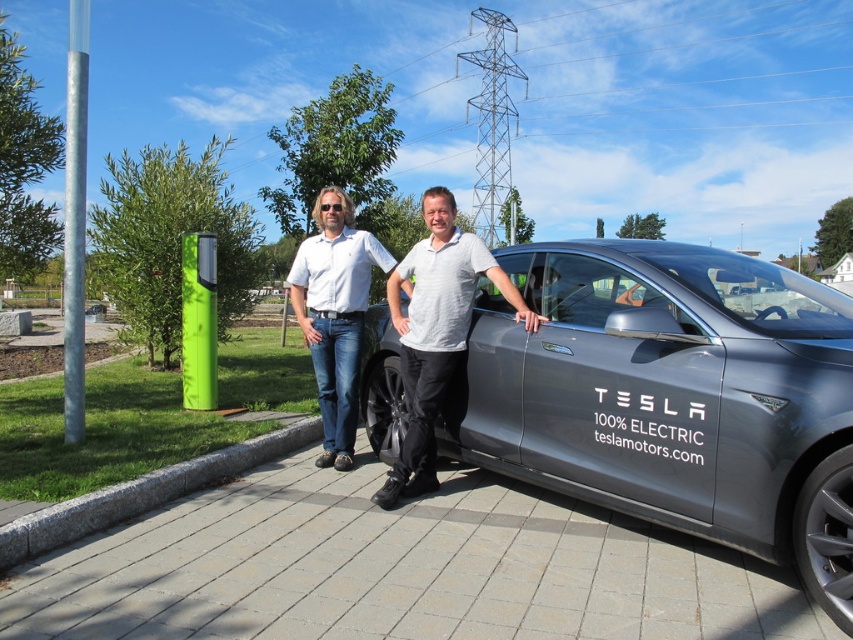
You are a delivery person needing to place a package on the trunk of the sleek metallic tesla at center. The package requires a minimum of 8 feet of clearance from the viewer to reach the trunk. Can you reach the trunk with the current distance?

The sleek metallic tesla at center is 8.65 feet from viewer. Since the required clearance is 8 feet, the distance is sufficient to reach the trunk.

You are standing at the origin of a coordinate system placed at the bottom left corner of the image. The Tesla Model S is at point (671, 396). If you want to walk directly to the Tesla Model S from your current position, in which direction should you move?

Since the Tesla Model S is located at point (671, 396), which is to the right and above your current position at the origin, you should move northeast to reach it.